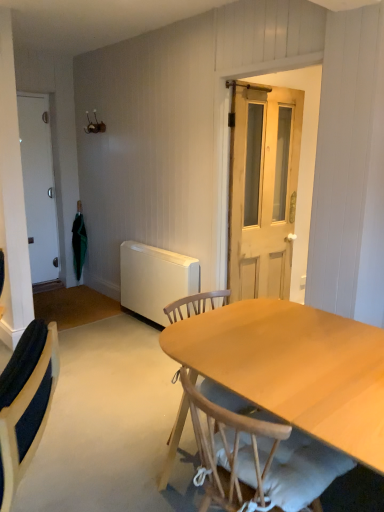
Question: Considering the relative sizes of white fabric tablecloth at center and white matte door at left, positioned as the 2th door in right-to-left order, in the image provided, is white fabric tablecloth at center bigger than white matte door at left, positioned as the 2th door in right-to-left order,?

Choices:
 (A) yes
 (B) no

Answer: (A)

Question: Is white fabric tablecloth at center oriented towards white matte door at left, positioned as the 2th door in right-to-left order?

Choices:
 (A) no
 (B) yes

Answer: (A)

Question: Is white fabric tablecloth at center positioned with its back to white matte door at left, acting as the 1th door starting from the back?

Choices:
 (A) no
 (B) yes

Answer: (B)

Question: Can you confirm if white fabric tablecloth at center is positioned to the right of white matte door at left, acting as the 1th door starting from the back?

Choices:
 (A) yes
 (B) no

Answer: (A)

Question: Considering the relative positions of white fabric tablecloth at center and white matte door at left, the second door viewed from the front, in the image provided, is white fabric tablecloth at center behind white matte door at left, the second door viewed from the front,?

Choices:
 (A) yes
 (B) no

Answer: (B)

Question: Is point (228, 120) closer or farther from the camera than point (84, 251)?

Choices:
 (A) closer
 (B) farther

Answer: (A)

Question: Considering their positions, is light brown wooden door at center, the second door in the back-to-front sequence, located in front of or behind green fabric umbrella at left?

Choices:
 (A) front
 (B) behind

Answer: (A)

Question: From the image's perspective, relative to green fabric umbrella at left, is light brown wooden door at center, which is counted as the 1th door, starting from the front, above or below?

Choices:
 (A) above
 (B) below

Answer: (A)

Question: Would you say light brown wooden door at center, which ranks as the first door in right-to-left order, is inside or outside green fabric umbrella at left?

Choices:
 (A) inside
 (B) outside

Answer: (B)

Question: Based on their positions, is white fabric tablecloth at center located to the left or right of green fabric umbrella at left?

Choices:
 (A) left
 (B) right

Answer: (B)

Question: From a real-world perspective, is white fabric tablecloth at center above or below green fabric umbrella at left?

Choices:
 (A) above
 (B) below

Answer: (B)

Question: Is white fabric tablecloth at center spatially inside green fabric umbrella at left, or outside of it?

Choices:
 (A) inside
 (B) outside

Answer: (B)

Question: Is white fabric tablecloth at center bigger or smaller than green fabric umbrella at left?

Choices:
 (A) big
 (B) small

Answer: (A)

Question: From a real-world perspective, is white matte door at left, positioned as the 2th door in right-to-left order, positioned above or below white fabric tablecloth at center?

Choices:
 (A) above
 (B) below

Answer: (A)

Question: In terms of height, does white matte door at left, acting as the 1th door starting from the back, look taller or shorter compared to white fabric tablecloth at center?

Choices:
 (A) tall
 (B) short

Answer: (A)